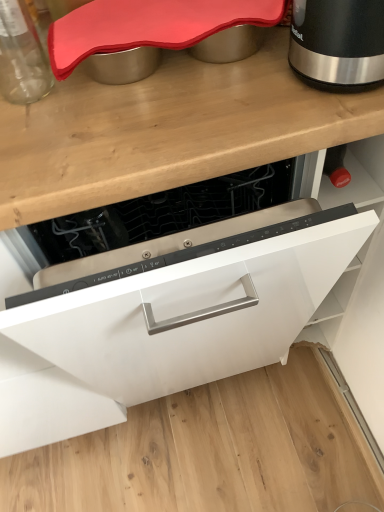
Question: Considering the relative positions of white matte cabinet at center and transparent glass jar at upper left in the image provided, is white matte cabinet at center to the right of transparent glass jar at upper left from the viewer's perspective?

Choices:
 (A) no
 (B) yes

Answer: (B)

Question: Is white matte cabinet at center thinner than transparent glass jar at upper left?

Choices:
 (A) no
 (B) yes

Answer: (A)

Question: Considering the relative positions of white matte cabinet at center and transparent glass jar at upper left in the image provided, is white matte cabinet at center to the left of transparent glass jar at upper left from the viewer's perspective?

Choices:
 (A) no
 (B) yes

Answer: (A)

Question: Is white matte cabinet at center shorter than transparent glass jar at upper left?

Choices:
 (A) no
 (B) yes

Answer: (A)

Question: Is white matte cabinet at center far from transparent glass jar at upper left?

Choices:
 (A) no
 (B) yes

Answer: (A)

Question: Considering the relative sizes of white matte cabinet at center and transparent glass jar at upper left in the image provided, is white matte cabinet at center taller than transparent glass jar at upper left?

Choices:
 (A) yes
 (B) no

Answer: (A)

Question: Could you tell me if transparent glass jar at upper left is turned towards white matte cabinet at center?

Choices:
 (A) yes
 (B) no

Answer: (B)

Question: Does transparent glass jar at upper left have a larger size compared to white matte cabinet at center?

Choices:
 (A) no
 (B) yes

Answer: (A)

Question: Is the position of transparent glass jar at upper left more distant than that of white matte cabinet at center?

Choices:
 (A) no
 (B) yes

Answer: (B)

Question: From the image's perspective, would you say transparent glass jar at upper left is shown under white matte cabinet at center?

Choices:
 (A) no
 (B) yes

Answer: (A)

Question: From the image's perspective, is transparent glass jar at upper left located above white matte cabinet at center?

Choices:
 (A) yes
 (B) no

Answer: (A)

Question: Considering the relative positions of transparent glass jar at upper left and white matte cabinet at center in the image provided, is transparent glass jar at upper left in front of white matte cabinet at center?

Choices:
 (A) yes
 (B) no

Answer: (B)

Question: Is black metallic kettle at upper right facing away from white matte cabinet at center?

Choices:
 (A) no
 (B) yes

Answer: (A)